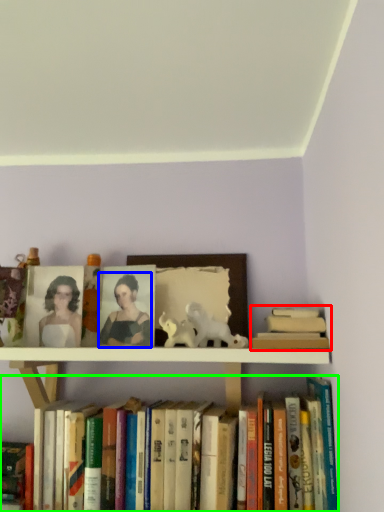
Question: Which is nearer to the book (highlighted by a red box)? person (highlighted by a blue box) or book (highlighted by a green box).

Choices:
 (A) person
 (B) book

Answer: (B)